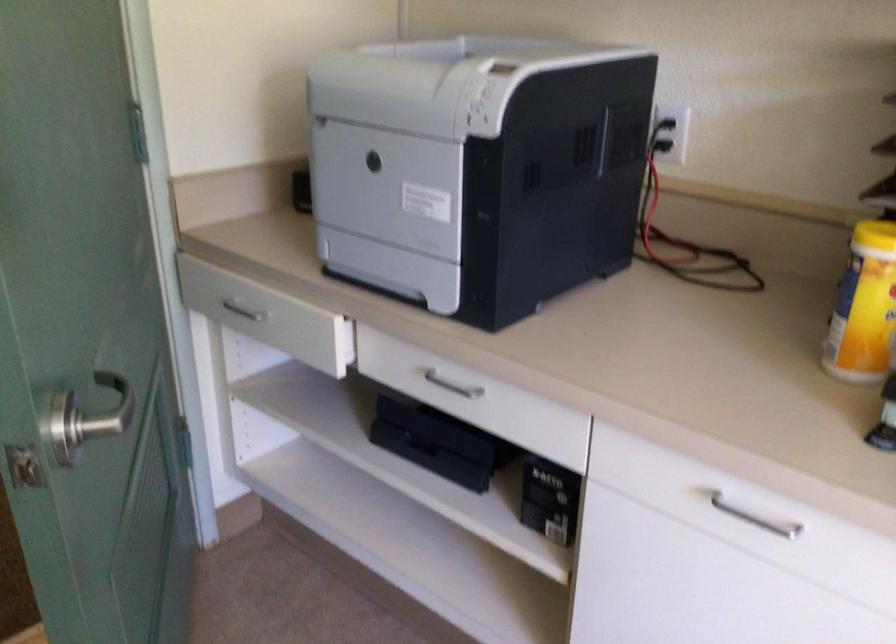
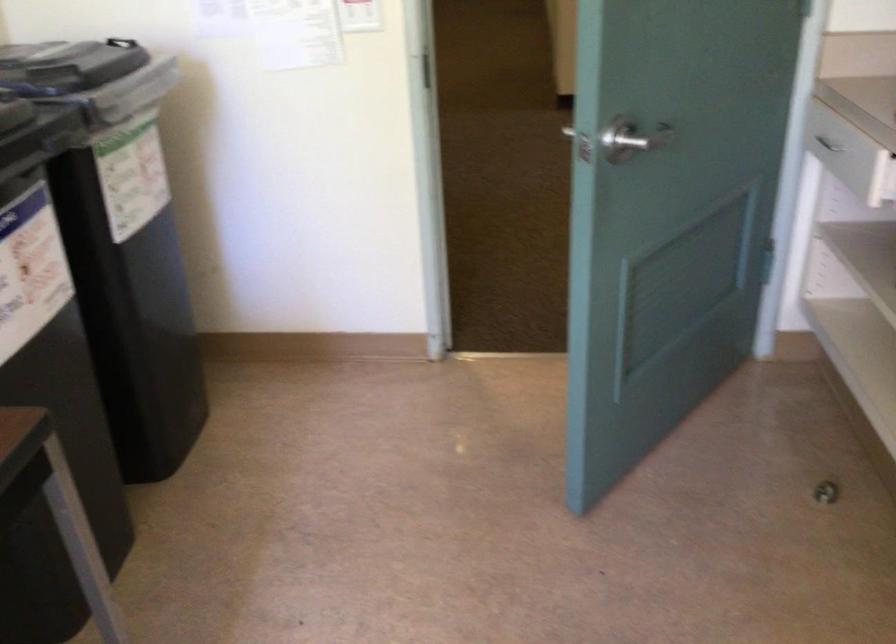
Locate, in the second image, the point that corresponds to (x=98, y=424) in the first image.

(633, 138)